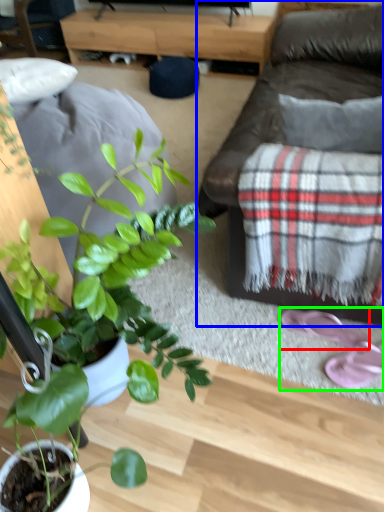
Question: Considering the real-world distances, which object is farthest from footwear (highlighted by a red box)? studio couch (highlighted by a blue box) or footwear (highlighted by a green box)?

Choices:
 (A) studio couch
 (B) footwear

Answer: (A)